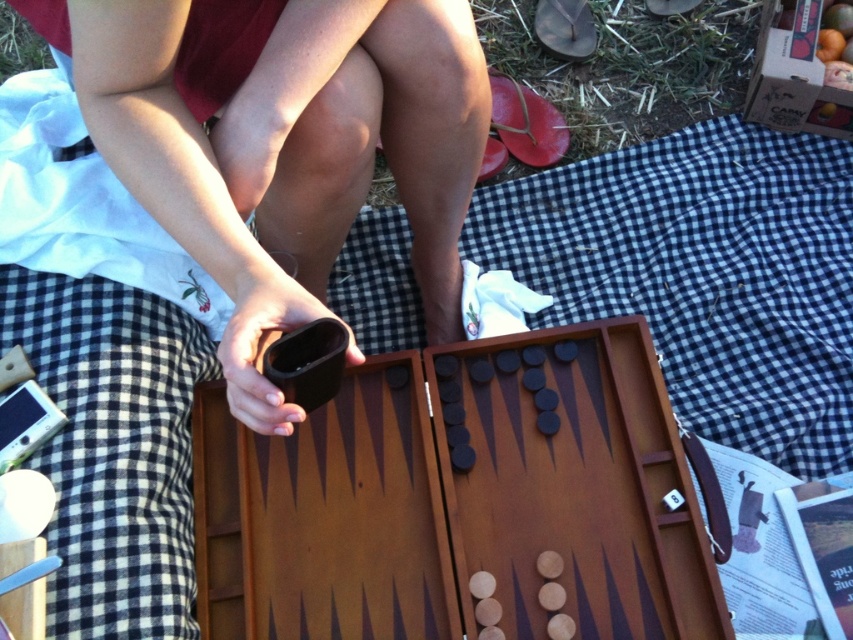
Question: Can you confirm if matte brown backgammon board at center is positioned below brown wooden backgammon board at center?

Choices:
 (A) yes
 (B) no

Answer: (B)

Question: Which of the following is the farthest from the observer?

Choices:
 (A) matte brown backgammon board at center
 (B) brown wooden backgammon board at center

Answer: (B)

Question: Can you confirm if matte brown backgammon board at center is positioned to the left of brown wooden backgammon board at center?

Choices:
 (A) yes
 (B) no

Answer: (A)

Question: Does matte brown backgammon board at center have a larger size compared to brown wooden backgammon board at center?

Choices:
 (A) yes
 (B) no

Answer: (A)

Question: Which object is closer to the camera taking this photo?

Choices:
 (A) brown wooden backgammon board at center
 (B) matte brown backgammon board at center

Answer: (B)